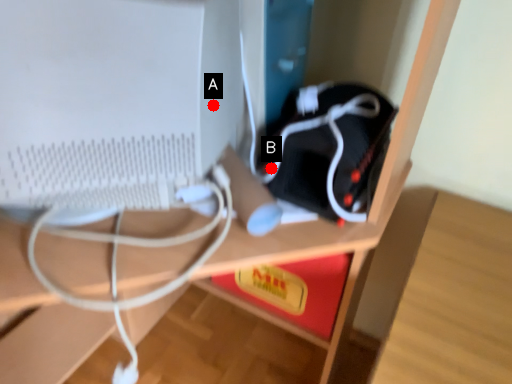
Question: Two points are circled on the image, labeled by A and B beside each circle. Which of the following is the closest to the observer?

Choices:
 (A) A is closer
 (B) B is closer

Answer: (A)